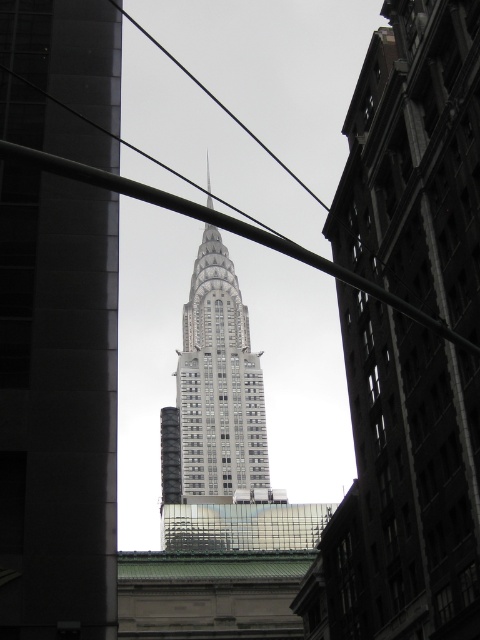
Question: Can you confirm if silver glass skyscraper at center is positioned above metallic wire at center?

Choices:
 (A) no
 (B) yes

Answer: (B)

Question: Can you confirm if gray glass skyscraper at center is positioned to the left of metallic wire at center?

Choices:
 (A) yes
 (B) no

Answer: (A)

Question: Is silver glass skyscraper at center above black wire at upper center?

Choices:
 (A) no
 (B) yes

Answer: (A)

Question: Which point is closer to the camera?

Choices:
 (A) silver glass skyscraper at center
 (B) black wire at upper center
 (C) gray glass skyscraper at center

Answer: (C)

Question: Estimate the real-world distances between objects in this image. Which object is closer to the black wire at upper center?

Choices:
 (A) silver glass skyscraper at center
 (B) metallic wire at center
 (C) gray glass skyscraper at center

Answer: (A)

Question: Among these objects, which one is farthest from the camera?

Choices:
 (A) silver glass skyscraper at center
 (B) gray glass skyscraper at center

Answer: (A)